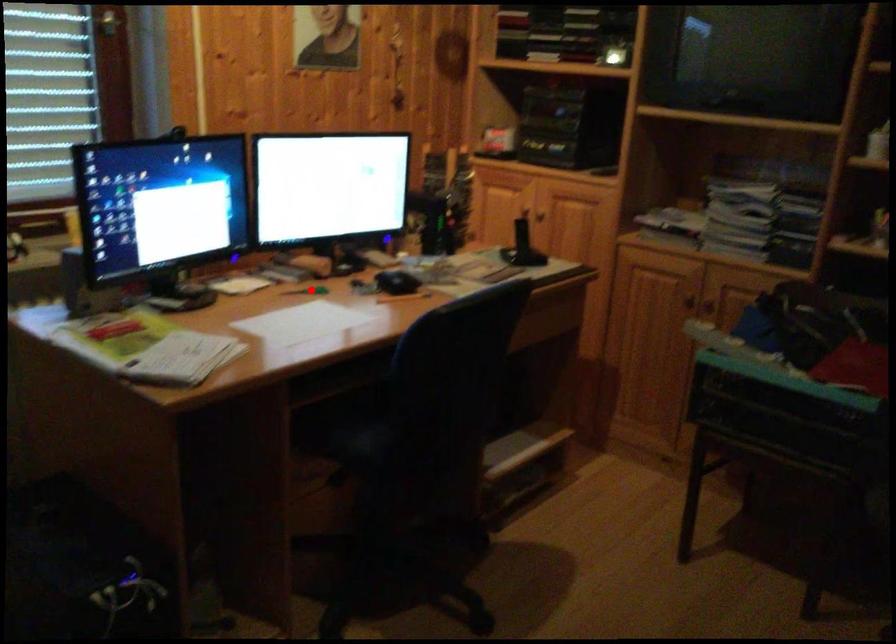
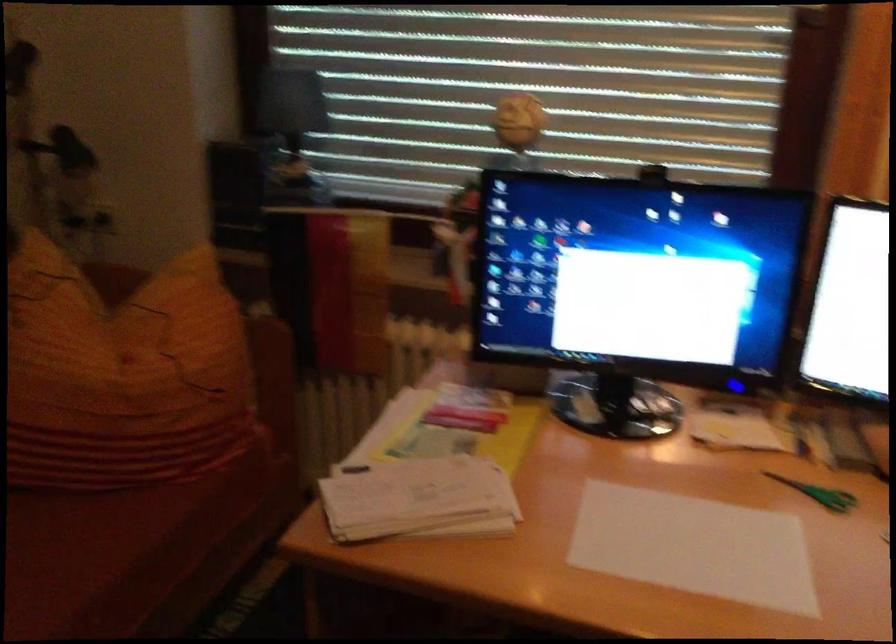
Question: I am providing you with two images of the same scene from different viewpoints. Image1 has a red point marked. In image2, the corresponding 3D location appears at what relative position? Reply with the corresponding letter.

Choices:
 (A) Closer
 (B) Farther

Answer: (A)